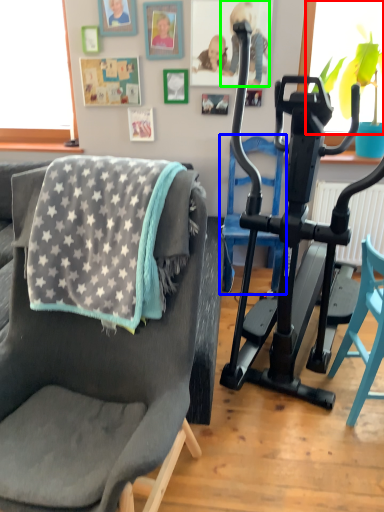
Question: Which object is positioned farthest from window screen (highlighted by a red box)? Select from armchair (highlighted by a blue box) and person (highlighted by a green box).

Choices:
 (A) armchair
 (B) person

Answer: (A)